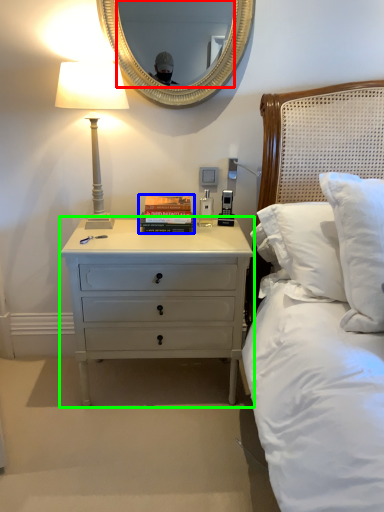
Question: Which object is positioned closest to mirror (highlighted by a red box)? Select from paperback book (highlighted by a blue box) and nightstand (highlighted by a green box).

Choices:
 (A) paperback book
 (B) nightstand

Answer: (A)